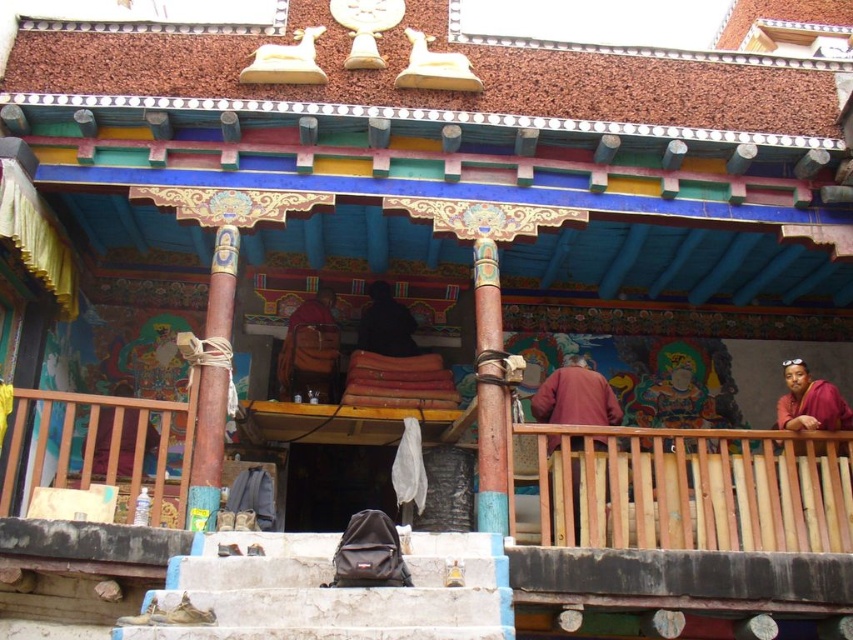
Which is in front, point (402, 636) or point (601, 444)?

Point (402, 636)

Who is taller, white stone stairs at lower center or maroon woolen robe at center?

With more height is maroon woolen robe at center.

Does point (285, 532) come closer to viewer compared to point (582, 442)?

Yes, it is.

Locate an element on the screen. This screenshot has height=640, width=853. white stone stairs at lower center is located at coordinates (332, 589).